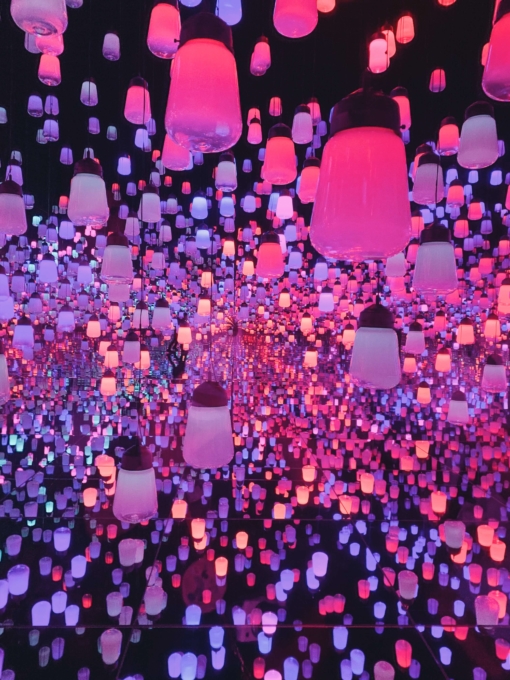
Find the location of a particular element. The height and width of the screenshot is (680, 510). numerous lights is located at coordinates (314, 143), (306, 574), (132, 607), (138, 413), (352, 585).